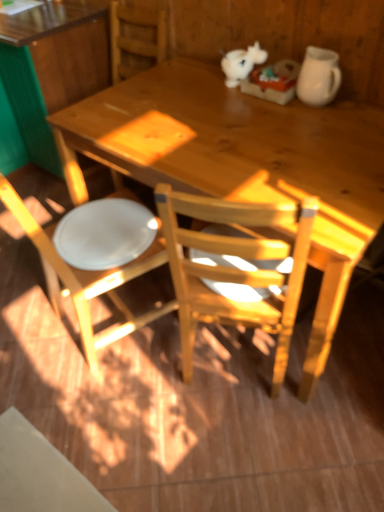
The image size is (384, 512). What are the coordinates of `vacant area that lies in front of white matte chair at left` in the screenshot? It's located at (105, 411).